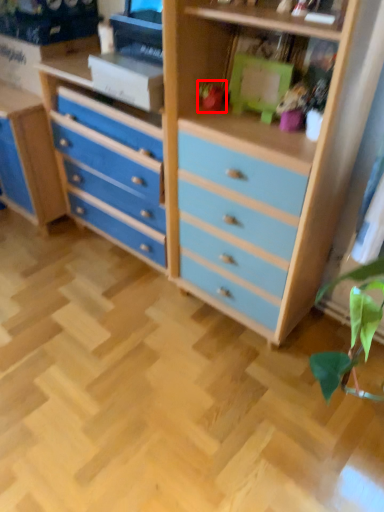
Question: From the image's perspective, considering the relative positions of toy (annotated by the red box) and toy in the image provided, where is toy (annotated by the red box) located with respect to the staircase?

Choices:
 (A) below
 (B) above

Answer: (B)